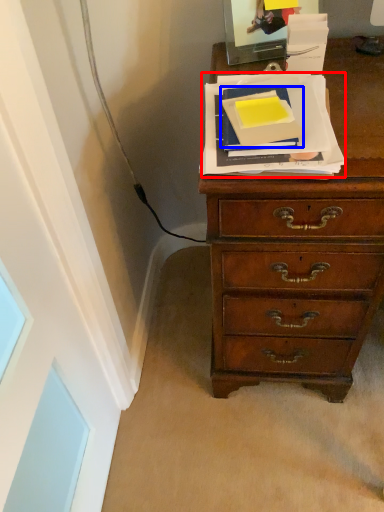
Question: Which object appears farthest to the camera in this image, paperback book (highlighted by a red box) or paperback book (highlighted by a blue box)?

Choices:
 (A) paperback book
 (B) paperback book

Answer: (B)